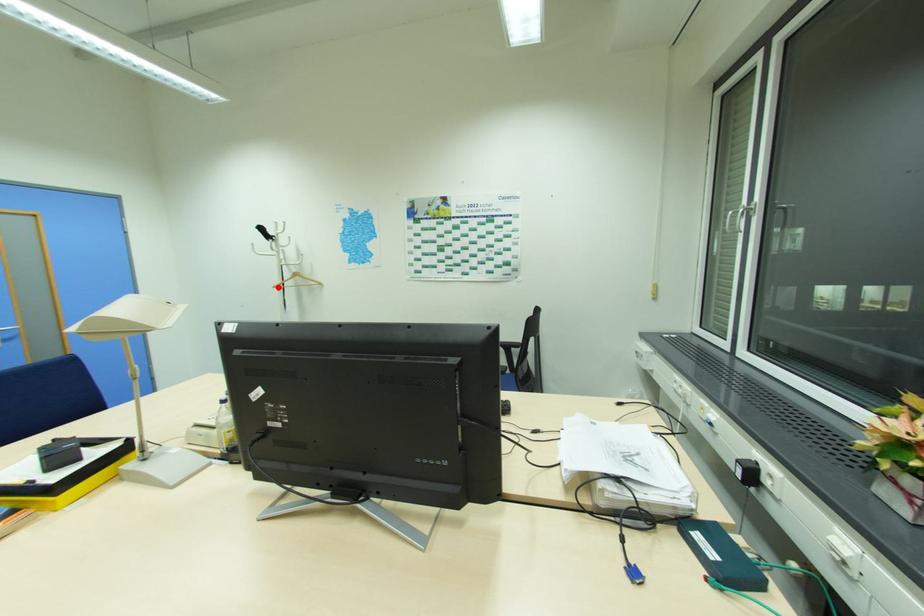
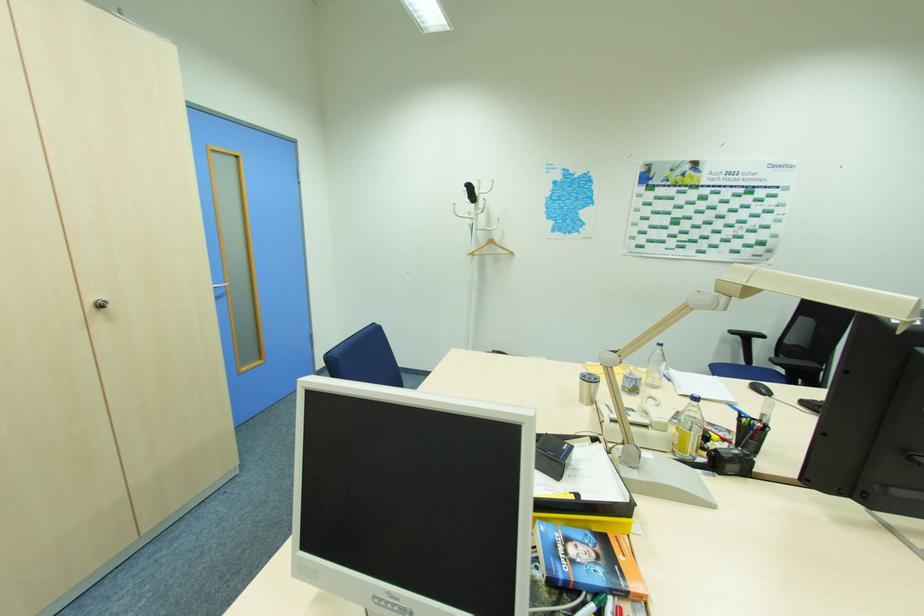
Locate, in the second image, the point that corresponds to the highlighted location in the first image.

(472, 254)